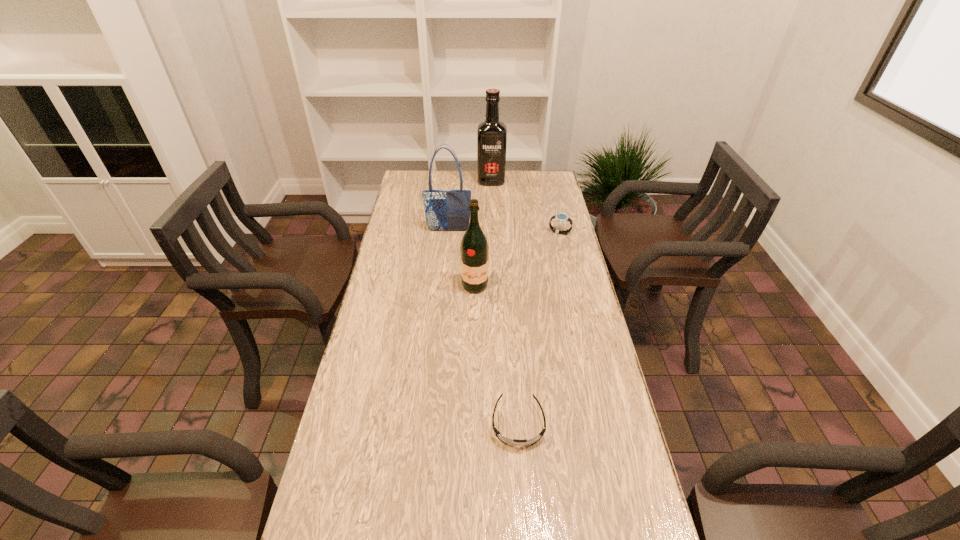
Image resolution: width=960 pixels, height=540 pixels. What are the coordinates of `vacant space at the far left corner` in the screenshot? It's located at (422, 181).

This screenshot has width=960, height=540. Identify the location of blank space at the far right corner. (549, 195).

This screenshot has height=540, width=960. I want to click on free point between the fourth tallest object and the taller liquor, so click(x=525, y=207).

The image size is (960, 540). I want to click on vacant space that's between the shortest object and the shopping bag, so click(x=483, y=327).

Find the location of a particular element. The image size is (960, 540). free space between the rightmost object and the second nearest object is located at coordinates (517, 259).

What are the coordinates of `vacant region between the nearest object and the watch` in the screenshot? It's located at (539, 328).

Locate an element on the screen. The height and width of the screenshot is (540, 960). object that is the nearest to the shopping bag is located at coordinates (x=474, y=250).

Identify which object is the second closest to the farthest object. Please provide its 2D coordinates. Your answer should be formatted as a tuple, i.e. [(x, y)], where the tuple contains the x and y coordinates of a point satisfying the conditions above.

[(561, 218)]

Find the location of a particular element. This screenshot has width=960, height=540. vacant position in the image that satisfies the following two spatial constraints: 1. on the front-facing side of the rightmost object; 2. on the right side of the farther liquor is located at coordinates click(493, 233).